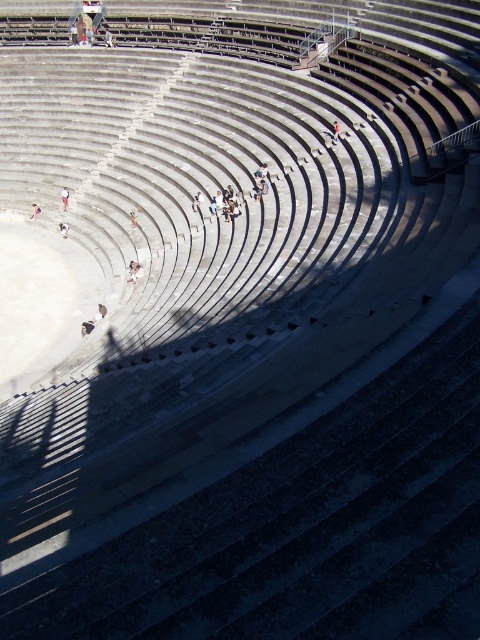
You are an archaeologist examining the ancient amphitheater. You notice a light brown wooden chair at upper center and a light brown wooden bench at center. Which object is located to the left of the other?

The light brown wooden chair at upper center is positioned on the left side of the light brown wooden bench at center.

You are standing at the entrance of the ancient amphitheater and see two points marked on the stone seats. The first point is at coordinate point (73, 26) and the second is at point (38, 212). Which point is closer to the back of the amphitheater?

Point (73, 26) is behind point (38, 212), so it is closer to the back of the amphitheater.